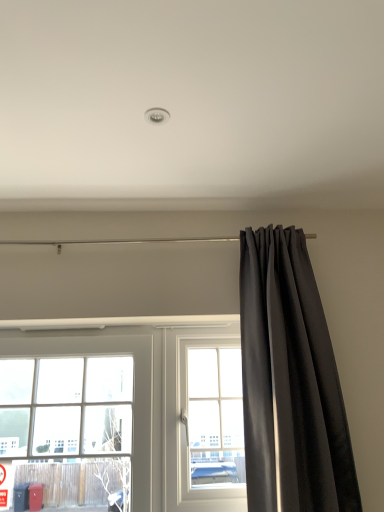
In order to click on clear glass window at center, which ranks as the first window in right-to-left order in this screenshot , I will do `click(204, 421)`.

From the picture: From a real-world perspective, is clear glass window at left, the first window when ordered from left to right, positioned above or below clear glass window at center, arranged as the 2th window when viewed from the left?

In terms of real-world spatial position, clear glass window at left, the first window when ordered from left to right, is below clear glass window at center, arranged as the 2th window when viewed from the left.

Can you confirm if clear glass window at left, the 2th window positioned from the right, is smaller than clear glass window at center, arranged as the 2th window when viewed from the left?

Actually, clear glass window at left, the 2th window positioned from the right, might be larger than clear glass window at center, arranged as the 2th window when viewed from the left.

Locate an element on the screen. Image resolution: width=384 pixels, height=512 pixels. window located in front of the clear glass window at center, which ranks as the first window in right-to-left order is located at coordinates (107, 413).

From the picture: Is clear glass window at left, the 2th window positioned from the right, oriented towards clear glass window at center, which ranks as the first window in right-to-left order?

No, clear glass window at left, the 2th window positioned from the right, is not oriented towards clear glass window at center, which ranks as the first window in right-to-left order.

Is clear glass window at left, the first window when ordered from left to right, facing towards black velvet curtain at right?

No.

Which object is further away from the camera taking this photo, clear glass window at left, the 2th window positioned from the right, or black velvet curtain at right?

clear glass window at left, the 2th window positioned from the right, is further away from the camera.

In the scene shown: From the image's perspective, relative to black velvet curtain at right, is clear glass window at left, the 2th window positioned from the right, above or below?

clear glass window at left, the 2th window positioned from the right, is situated lower than black velvet curtain at right in the image.

Are clear glass window at center, which ranks as the first window in right-to-left order, and clear glass window at left, the first window when ordered from left to right, far apart?

No, clear glass window at center, which ranks as the first window in right-to-left order, is not far from clear glass window at left, the first window when ordered from left to right.

At what (x,y) coordinates should I click in order to perform the action: click on window on the right of clear glass window at left, the 2th window positioned from the right. Please return your answer as a coordinate pair (x, y). Image resolution: width=384 pixels, height=512 pixels. Looking at the image, I should click on (204, 421).

Is clear glass window at center, which ranks as the first window in right-to-left order, wider than clear glass window at left, the 2th window positioned from the right?

No, clear glass window at center, which ranks as the first window in right-to-left order, is not wider than clear glass window at left, the 2th window positioned from the right.

From the image's perspective, which is above, clear glass window at center, which ranks as the first window in right-to-left order, or clear glass window at left, the 2th window positioned from the right?

clear glass window at left, the 2th window positioned from the right, appears higher in the image.

Can you tell me how much clear glass window at center, arranged as the 2th window when viewed from the left, and black velvet curtain at right differ in facing direction?

0.00261 degrees.

Can you confirm if clear glass window at center, arranged as the 2th window when viewed from the left, is positioned to the right of black velvet curtain at right?

No, clear glass window at center, arranged as the 2th window when viewed from the left, is not to the right of black velvet curtain at right.

Which is in front, clear glass window at center, which ranks as the first window in right-to-left order, or black velvet curtain at right?

Positioned in front is black velvet curtain at right.

Can you confirm if clear glass window at center, arranged as the 2th window when viewed from the left, is shorter than black velvet curtain at right?

Indeed, clear glass window at center, arranged as the 2th window when viewed from the left, has a lesser height compared to black velvet curtain at right.

Which object is wider, black velvet curtain at right or clear glass window at center, which ranks as the first window in right-to-left order?

black velvet curtain at right.

Can you tell me how much black velvet curtain at right and clear glass window at center, arranged as the 2th window when viewed from the left, differ in facing direction?

The angle between the facing direction of black velvet curtain at right and the facing direction of clear glass window at center, arranged as the 2th window when viewed from the left, is 0.00261 degrees.

Are black velvet curtain at right and clear glass window at center, which ranks as the first window in right-to-left order, located far from each other?

black velvet curtain at right is actually quite close to clear glass window at center, which ranks as the first window in right-to-left order.

Which point is more distant from viewer, (293, 297) or (218, 373)?

Point (218, 373)

Does black velvet curtain at right lie behind clear glass window at left, the 2th window positioned from the right?

No, the depth of black velvet curtain at right is less than that of clear glass window at left, the 2th window positioned from the right.

Does black velvet curtain at right have a smaller size compared to clear glass window at left, the first window when ordered from left to right?

No, black velvet curtain at right is not smaller than clear glass window at left, the first window when ordered from left to right.

Can you tell me how much black velvet curtain at right and clear glass window at left, the 2th window positioned from the right, differ in facing direction?

The angular difference between black velvet curtain at right and clear glass window at left, the 2th window positioned from the right, is 0.00347 degrees.

Identify the location of window that appears below the clear glass window at left, the first window when ordered from left to right (from the image's perspective). Image resolution: width=384 pixels, height=512 pixels. (204, 421).

There is a clear glass window at left, the first window when ordered from left to right. Where is `curtain above it (from a real-world perspective)`? The height and width of the screenshot is (512, 384). curtain above it (from a real-world perspective) is located at coordinates (290, 383).

Based on their spatial positions, is clear glass window at left, the 2th window positioned from the right, or black velvet curtain at right further from clear glass window at center, arranged as the 2th window when viewed from the left?

black velvet curtain at right is further to clear glass window at center, arranged as the 2th window when viewed from the left.

Considering their positions, is clear glass window at left, the first window when ordered from left to right, positioned further to black velvet curtain at right than clear glass window at center, arranged as the 2th window when viewed from the left?

The object further to black velvet curtain at right is clear glass window at left, the first window when ordered from left to right.

Which object lies nearer to the anchor point clear glass window at left, the 2th window positioned from the right, clear glass window at center, which ranks as the first window in right-to-left order, or black velvet curtain at right?

clear glass window at center, which ranks as the first window in right-to-left order, is closer to clear glass window at left, the 2th window positioned from the right.

Estimate the real-world distances between objects in this image. Which object is closer to black velvet curtain at right, clear glass window at center, arranged as the 2th window when viewed from the left, or clear glass window at left, the first window when ordered from left to right?

→ Among the two, clear glass window at center, arranged as the 2th window when viewed from the left, is located nearer to black velvet curtain at right.

Looking at the image, which one is located closer to clear glass window at center, which ranks as the first window in right-to-left order, black velvet curtain at right or clear glass window at left, the 2th window positioned from the right?

clear glass window at left, the 2th window positioned from the right, is closer to clear glass window at center, which ranks as the first window in right-to-left order.

Estimate the real-world distances between objects in this image. Which object is further from clear glass window at left, the first window when ordered from left to right, black velvet curtain at right or clear glass window at center, which ranks as the first window in right-to-left order?

Based on the image, black velvet curtain at right appears to be further to clear glass window at left, the first window when ordered from left to right.

What are the coordinates of `window situated between clear glass window at left, the first window when ordered from left to right, and black velvet curtain at right from left to right` in the screenshot? It's located at (204, 421).